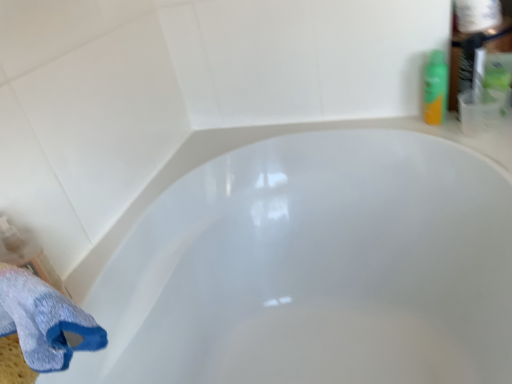
Question: Is white paper towel at upper right next to white glossy bathtub at center?

Choices:
 (A) yes
 (B) no

Answer: (B)

Question: Can you confirm if white paper towel at upper right is wider than white glossy bathtub at center?

Choices:
 (A) no
 (B) yes

Answer: (A)

Question: From the image's perspective, is white paper towel at upper right below white glossy bathtub at center?

Choices:
 (A) yes
 (B) no

Answer: (B)

Question: Is white paper towel at upper right oriented towards white glossy bathtub at center?

Choices:
 (A) yes
 (B) no

Answer: (B)

Question: Does white paper towel at upper right come in front of white glossy bathtub at center?

Choices:
 (A) yes
 (B) no

Answer: (B)

Question: Visually, is blue textured bath towel at lower left positioned to the left or to the right of white glossy bathtub at center?

Choices:
 (A) right
 (B) left

Answer: (B)

Question: Looking at their shapes, would you say blue textured bath towel at lower left is wider or thinner than white glossy bathtub at center?

Choices:
 (A) wide
 (B) thin

Answer: (B)

Question: Relative to white glossy bathtub at center, is blue textured bath towel at lower left in front or behind?

Choices:
 (A) front
 (B) behind

Answer: (B)

Question: From the image's perspective, is blue textured bath towel at lower left located above or below white glossy bathtub at center?

Choices:
 (A) below
 (B) above

Answer: (B)

Question: In the image, is green plastic spray can at upper right positioned in front of or behind white glossy bathtub at center?

Choices:
 (A) behind
 (B) front

Answer: (A)

Question: Is green plastic spray can at upper right taller or shorter than white glossy bathtub at center?

Choices:
 (A) short
 (B) tall

Answer: (A)

Question: Would you say green plastic spray can at upper right is inside or outside white glossy bathtub at center?

Choices:
 (A) inside
 (B) outside

Answer: (B)

Question: Looking at the image, does green plastic spray can at upper right seem bigger or smaller compared to white glossy bathtub at center?

Choices:
 (A) small
 (B) big

Answer: (A)

Question: Would you say white paper towel at upper right is inside or outside white glossy bathtub at center?

Choices:
 (A) outside
 (B) inside

Answer: (A)

Question: In terms of width, does white paper towel at upper right look wider or thinner when compared to white glossy bathtub at center?

Choices:
 (A) thin
 (B) wide

Answer: (A)